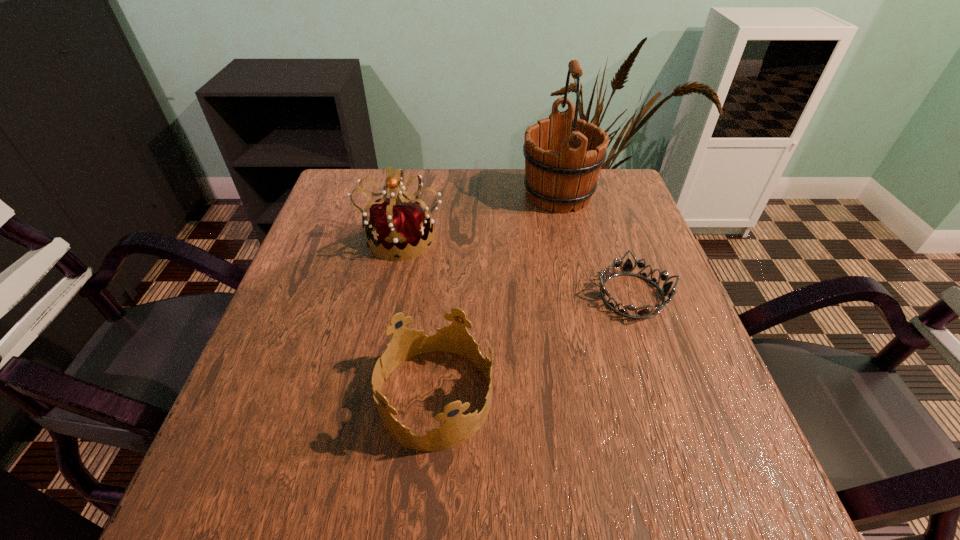
You are a GUI agent. You are given a task and a screenshot of the screen. Output one action in this format:
    pyautogui.click(x=<x>, y=<y>)
    Task: Click on the vacant space at the left edge of the desktop
    The height and width of the screenshot is (540, 960).
    Given the screenshot: What is the action you would take?
    pyautogui.click(x=331, y=355)

In the image, there is a desktop. Identify the location of vacant space at the right edge. (615, 269).

In the image, there is a desktop. At what (x,y) coordinates should I click in order to perform the action: click on vacant space at the far left corner. Please return your answer as a coordinate pair (x, y). This screenshot has width=960, height=540. Looking at the image, I should click on [328, 197].

In the image, there is a desktop. At what (x,y) coordinates should I click in order to perform the action: click on vacant area at the near left corner. Please return your answer as a coordinate pair (x, y). Looking at the image, I should click on (194, 494).

Where is `vacant space at the far right corner of the desktop`? The image size is (960, 540). vacant space at the far right corner of the desktop is located at coordinates click(x=598, y=196).

This screenshot has height=540, width=960. What are the coordinates of `empty space between the wine bucket and the tallest tiara` in the screenshot? It's located at tap(480, 215).

This screenshot has height=540, width=960. In order to click on free space between the shortest tiara and the second tallest object in this screenshot , I will do `click(517, 266)`.

Where is `empty space that is in between the tallest object and the third farthest object`? empty space that is in between the tallest object and the third farthest object is located at coordinates (595, 245).

Locate an element on the screen. The height and width of the screenshot is (540, 960). vacant space that's between the farthest tiara and the shortest object is located at coordinates (517, 266).

The width and height of the screenshot is (960, 540). In order to click on free point between the second farthest tiara and the tallest tiara in this screenshot , I will do `click(517, 266)`.